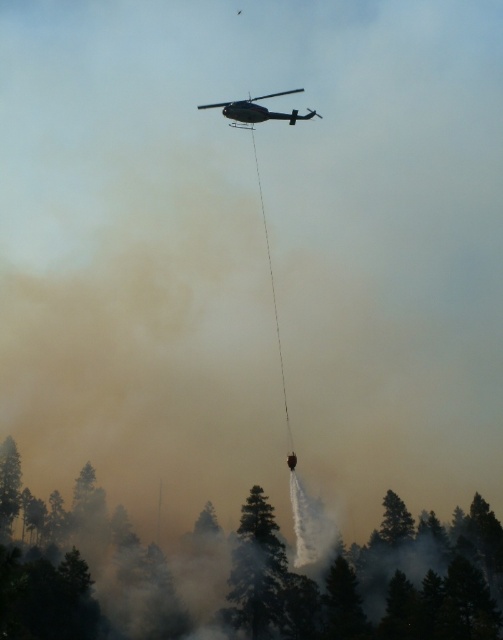
Who is lower down, green matte tree at lower center or metallic silver helicopter at upper center?

Positioned lower is green matte tree at lower center.

Between point (160, 620) and point (264, 118), which one is positioned behind?

The point (160, 620) is behind.

You are a GUI agent. You are given a task and a screenshot of the screen. Output one action in this format:
    pyautogui.click(x=<x>, y=<y>)
    Task: Click on the green matte tree at lower center
    
    Given the screenshot: What is the action you would take?
    pyautogui.click(x=242, y=572)

Does point (264, 513) come closer to viewer compared to point (233, 122)?

No, it is not.

Does green matte tree at center have a smaller size compared to metallic silver helicopter at upper center?

Indeed, green matte tree at center has a smaller size compared to metallic silver helicopter at upper center.

Which is behind, point (279, 609) or point (233, 108)?

Point (279, 609)

You are a GUI agent. You are given a task and a screenshot of the screen. Output one action in this format:
    pyautogui.click(x=<x>, y=<y>)
    Task: Click on the green matte tree at center
    The height and width of the screenshot is (640, 503).
    Given the screenshot: What is the action you would take?
    pyautogui.click(x=257, y=570)

Is point (53, 605) more distant than point (264, 529)?

No, it is not.

Does green matte tree at lower center have a lesser height compared to green matte tree at center?

No, green matte tree at lower center is not shorter than green matte tree at center.

Between point (117, 579) and point (285, 557), which one is positioned in front?

Point (285, 557)

This screenshot has width=503, height=640. What are the coordinates of `green matte tree at lower center` in the screenshot? It's located at (242, 572).